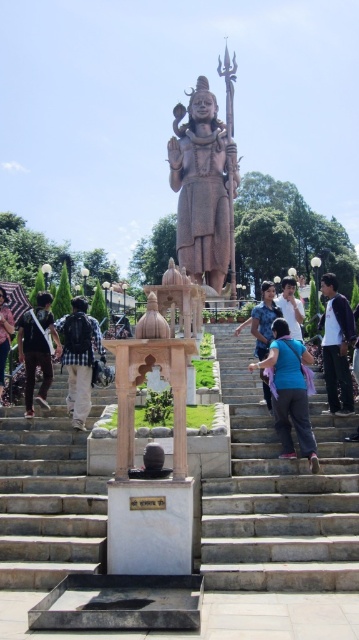
You are standing in front of the statue of Lord Shiva. There are two points marked in the image. One is at coordinate point (x=338, y=355) and the other at point (x=2, y=314). Which point is closer to you?

The point at coordinate (x=338, y=355) is closer to you than the point at (x=2, y=314).

You are a tourist carrying a dark blue backpack at center and want to climb the white marble stairs at center to reach the statue. Based on the scene, will the stairs be wide enough for you to climb comfortably while carrying the backpack?

The white marble stairs at center are wider than the dark blue backpack at center, so yes, the stairs are wide enough for you to climb comfortably while carrying the backpack.

You are a tourist visiting this sacred site and want to place your dark blue backpack at center near the white marble stairs at center. Given their sizes, will the backpack fit comfortably next to the stairs without blocking the pathway?

The white marble stairs at center is larger in size than the dark blue backpack at center, so placing the backpack next to the stairs may not block the pathway as the stairs are bigger. However, the backpack should be placed carefully to ensure it doesn not obstruct the path.